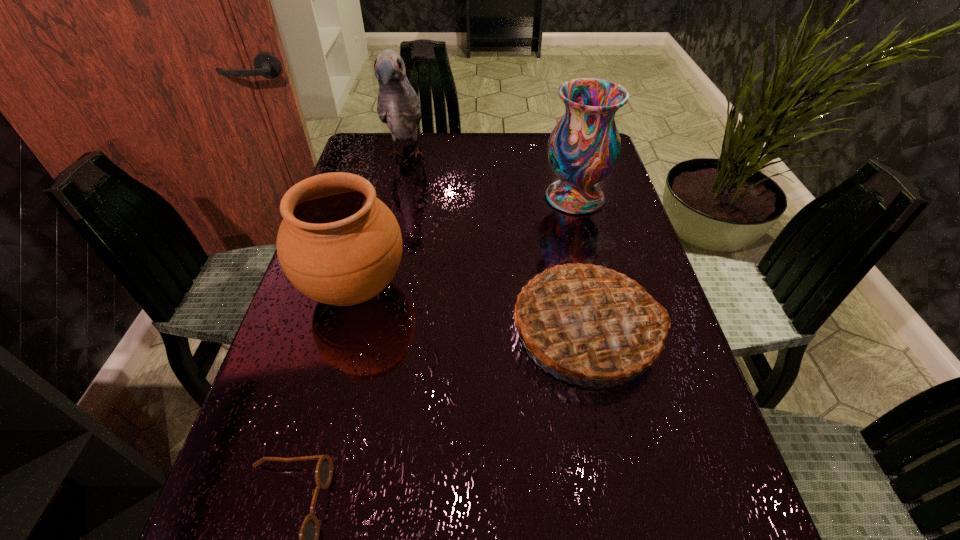
This screenshot has width=960, height=540. I want to click on parrot, so click(x=398, y=106).

Where is `vase`? vase is located at coordinates (583, 149).

The width and height of the screenshot is (960, 540). What are the coordinates of `pottery` in the screenshot? It's located at (338, 244).

Where is `pie`? Image resolution: width=960 pixels, height=540 pixels. pie is located at coordinates (587, 321).

Where is `vacant space located 0.320m on the front-facing side of the parrot`? vacant space located 0.320m on the front-facing side of the parrot is located at coordinates (383, 260).

Locate an element on the screen. blank space located on the left of the vase is located at coordinates click(x=411, y=197).

At what (x,y) coordinates should I click in order to perform the action: click on free spot located on the right of the pottery. Please return your answer as a coordinate pair (x, y). The height and width of the screenshot is (540, 960). Looking at the image, I should click on (508, 288).

The image size is (960, 540). Identify the location of vacant region located 0.370m on the back of the pie. (557, 184).

Locate an element on the screen. object at the far edge is located at coordinates (398, 106).

In order to click on parrot situated at the left edge in this screenshot , I will do `click(398, 106)`.